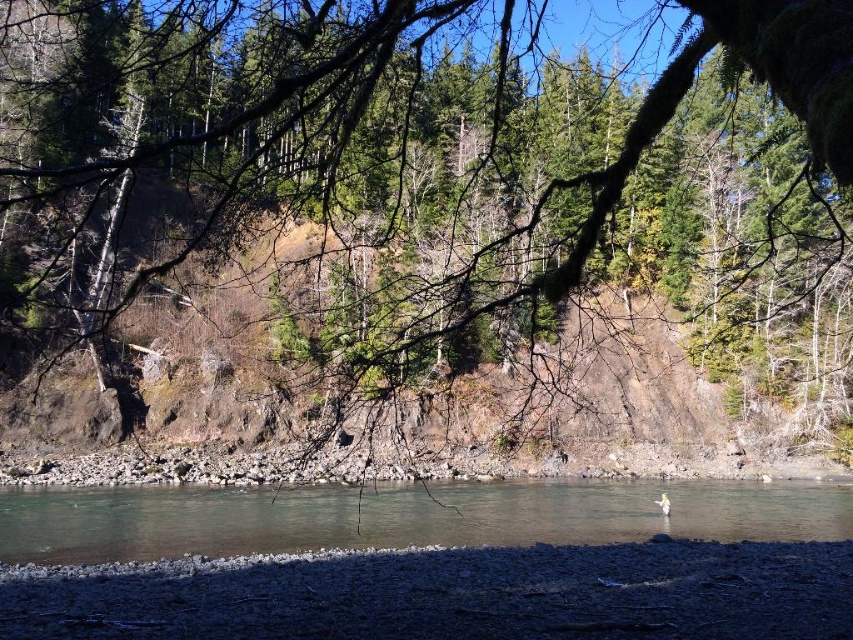
From the picture: Is green matte tree at center positioned in front of clear water at center?

That is True.

Who is positioned more to the right, green matte tree at center or clear water at center?

clear water at center is more to the right.

Is point (851, 122) positioned before point (585, 532)?

Yes, it is in front of point (585, 532).

Identify the location of green matte tree at center. Image resolution: width=853 pixels, height=640 pixels. (207, 116).